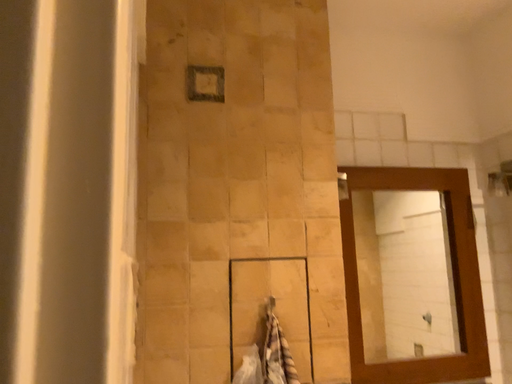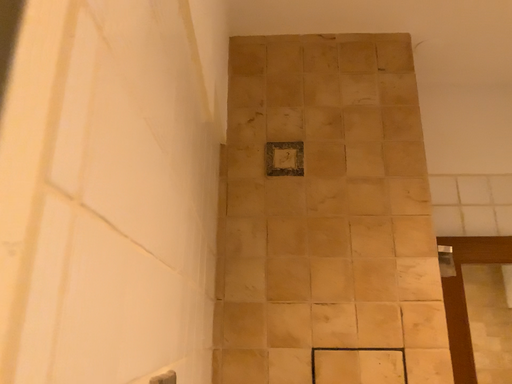
Question: How did the camera likely rotate when shooting the video?

Choices:
 (A) rotated downward
 (B) rotated upward

Answer: (B)